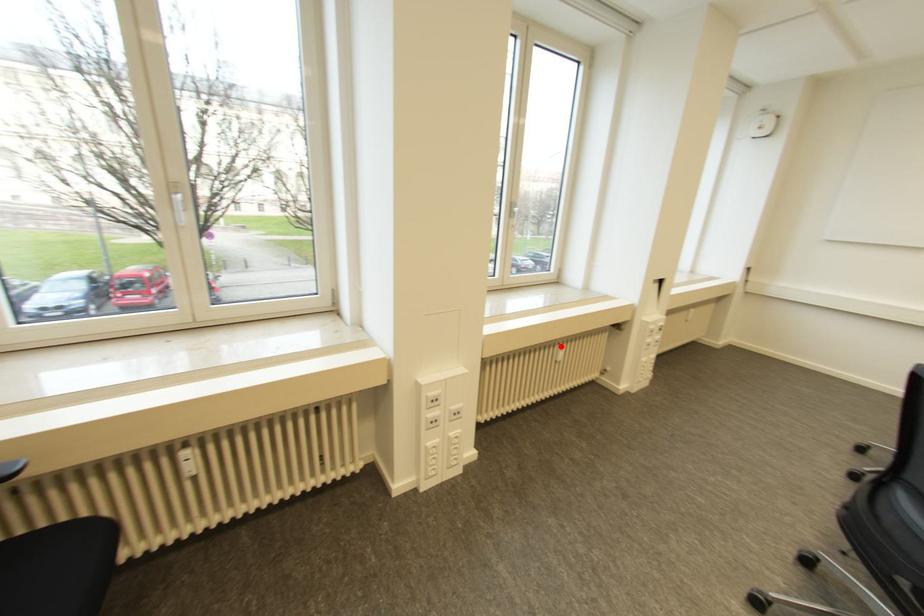
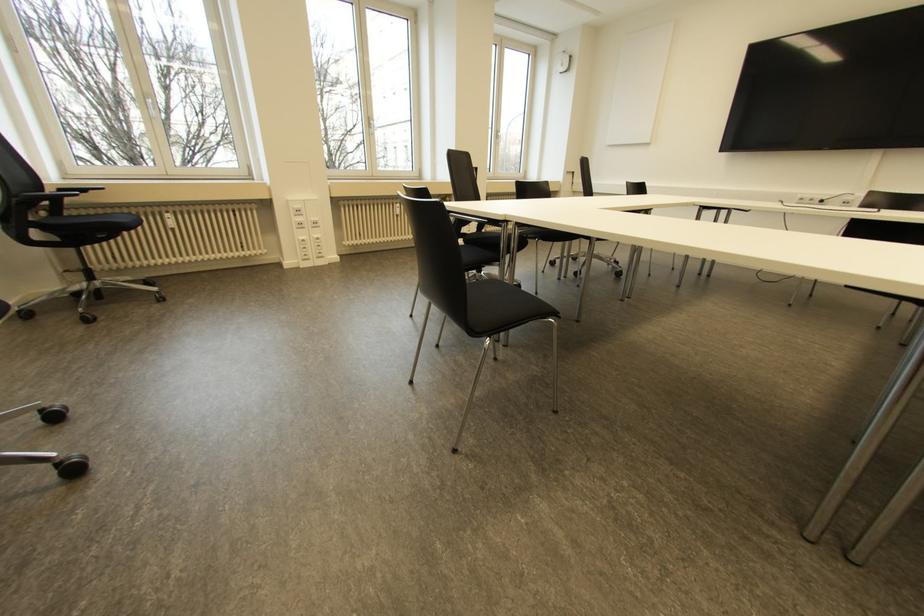
The point at the highlighted location is marked in the first image. Where is the corresponding point in the second image?

(397, 204)